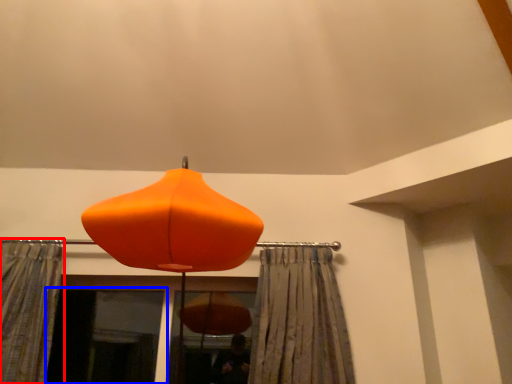
Question: Which of the following is the farthest to the observer, curtain (highlighted by a red box) or screen door (highlighted by a blue box)?

Choices:
 (A) curtain
 (B) screen door

Answer: (B)